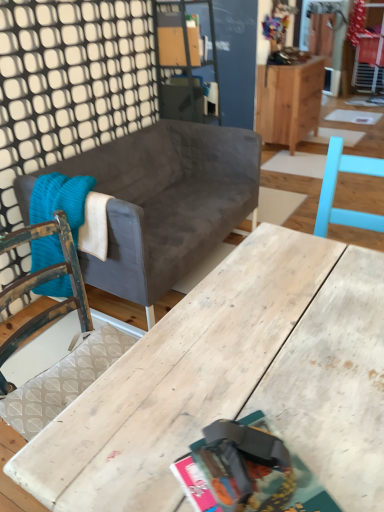
Question: From the image's perspective, relative to velvet gray couch at center, is wooden cabinet at upper right above or below?

Choices:
 (A) below
 (B) above

Answer: (B)

Question: From a real-world perspective, relative to velvet gray couch at center, is wooden cabinet at upper right vertically above or below?

Choices:
 (A) above
 (B) below

Answer: (A)

Question: Based on their relative distances, which object is nearer to the wooden cabinet at upper right?

Choices:
 (A) velvet gray couch at center
 (B) knitted wool blanket at left
 (C) wooden table at center
 (D) matte paper magazine at center

Answer: (A)

Question: Which object is positioned farthest from the wooden table at center?

Choices:
 (A) matte paper magazine at center
 (B) knitted wool blanket at left
 (C) velvet gray couch at center
 (D) wooden cabinet at upper right

Answer: (D)